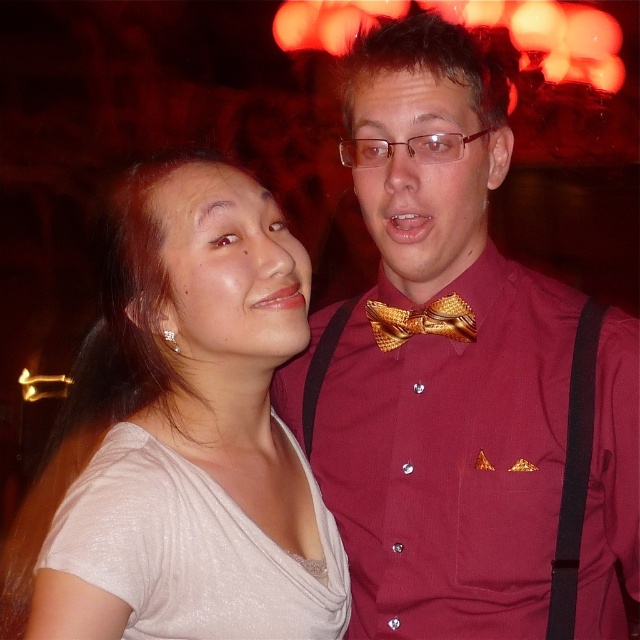
Is maroon shirt at center thinner than gold textured bow tie at center?

No, maroon shirt at center is not thinner than gold textured bow tie at center.

You are a GUI agent. You are given a task and a screenshot of the screen. Output one action in this format:
    pyautogui.click(x=<x>, y=<y>)
    Task: Click on the maroon shirt at center
    The height and width of the screenshot is (640, 640).
    Given the screenshot: What is the action you would take?
    [x=464, y=380]

What do you see at coordinates (182, 435) in the screenshot? I see `satin beige blouse at left` at bounding box center [182, 435].

Is satin beige blouse at left wider than satin white dress at lower left?

Yes, satin beige blouse at left is wider than satin white dress at lower left.

Locate an element on the screen. Image resolution: width=640 pixels, height=640 pixels. satin beige blouse at left is located at coordinates (182, 435).

Is satin white dress at lower left taller than gold textured bow tie at center?

Correct, satin white dress at lower left is much taller as gold textured bow tie at center.

Is satin white dress at lower left to the right of gold textured bow tie at center from the viewer's perspective?

In fact, satin white dress at lower left is to the left of gold textured bow tie at center.

Is point (115, 573) positioned after point (374, 308)?

No, (115, 573) is closer to viewer.

Identify the location of satin white dress at lower left. point(192,548).